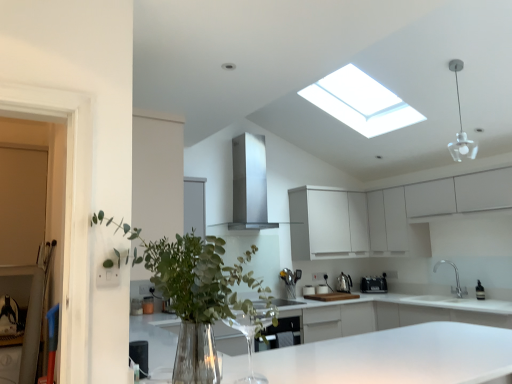
Question: Is white glossy countertop at center in front of or behind white glass pendant light at upper right in the image?

Choices:
 (A) behind
 (B) front

Answer: (B)

Question: From their relative heights in the image, would you say white glossy countertop at center is taller or shorter than white glass pendant light at upper right?

Choices:
 (A) short
 (B) tall

Answer: (B)

Question: Which is nearer to the white glossy countertop at center?

Choices:
 (A) stainless steel exhaust hood at center
 (B) white glass pendant light at upper right
 (C) metallic silver toaster at lower center, acting as the third appliance starting from the left
 (D) green leafy plant at center
 (E) white matte cabinet at upper center, acting as the second cabinetry starting from the front

Answer: (C)

Question: Considering the real-world distances, which object is closest to the polished stainless steel kettle at center, which is the second appliance in left-to-right order?

Choices:
 (A) silver metallic faucet at lower right
 (B) white glass pendant light at upper right
 (C) white plastic toaster at center, the first appliance when ordered from left to right
 (D) white matte cabinet at upper center, acting as the second cabinetry starting from the front
 (E) stainless steel exhaust hood at center

Answer: (C)